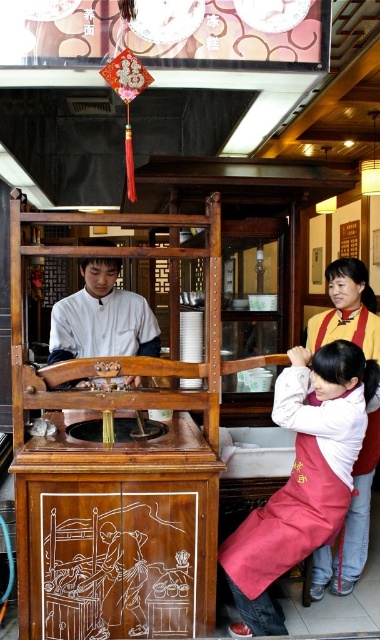
You are a customer sitting at the tea table and you see two points marked on the floor. The first point is at position point (321, 412) and the second point is at point (120, 301). Which point is closer to you?

Point (321, 412) is in front of point (120, 301), so the first point is closer to you.